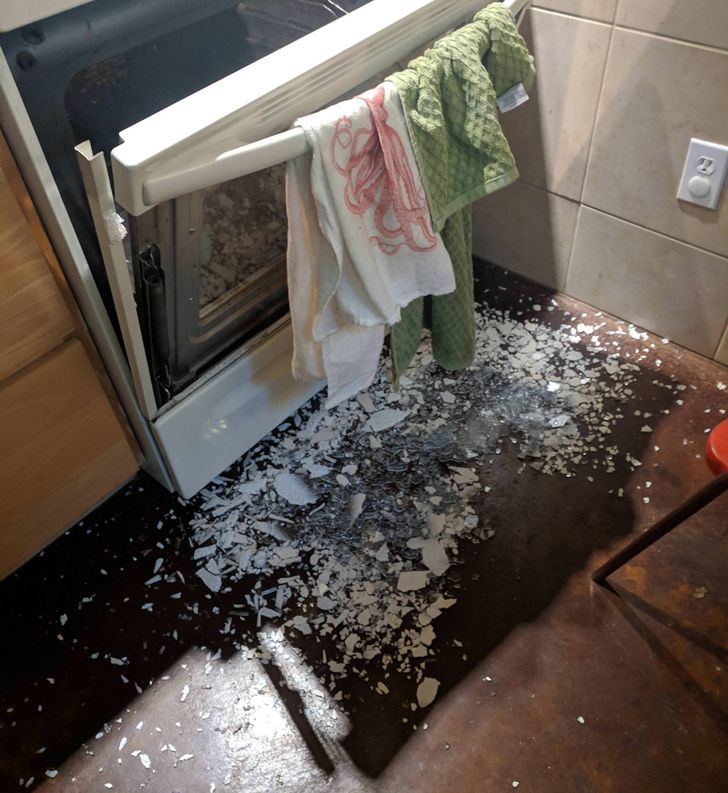
Find the location of `white towel`. white towel is located at coordinates (392, 259), (312, 220), (338, 332).